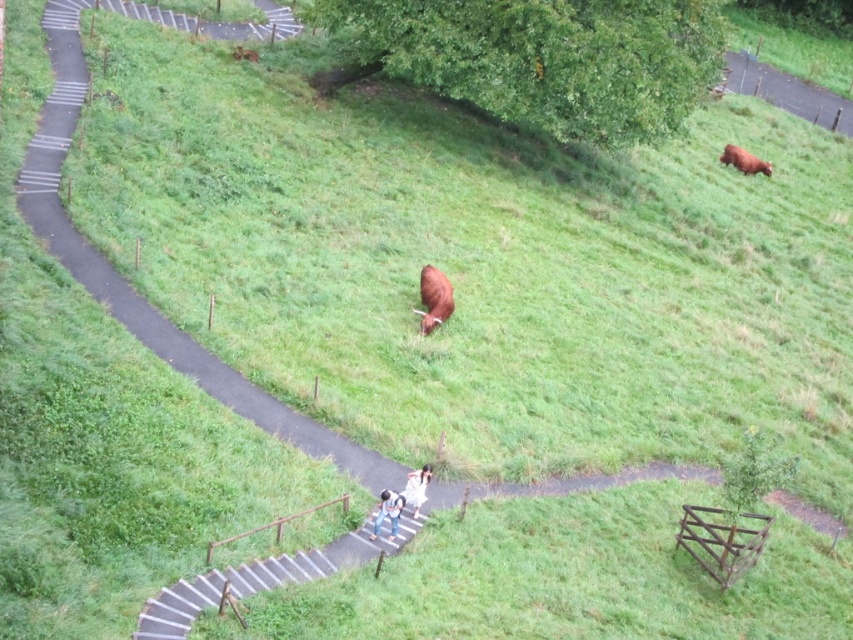
Can you confirm if metallic gray stairs at lower center is shorter than blue denim jeans at center?

Yes, metallic gray stairs at lower center is shorter than blue denim jeans at center.

Between metallic gray stairs at lower center and blue denim jeans at center, which one has more height?

blue denim jeans at center is taller.

The width and height of the screenshot is (853, 640). Identify the location of metallic gray stairs at lower center. (260, 579).

Identify the location of metallic gray stairs at lower center. The image size is (853, 640). (260, 579).

Is blue denim jeans at center smaller than brown matte cow at upper right?

Correct, blue denim jeans at center occupies less space than brown matte cow at upper right.

Between point (376, 516) and point (744, 172), which one is positioned behind?

The point (744, 172) is more distant.

What do you see at coordinates (387, 513) in the screenshot? I see `blue denim jeans at center` at bounding box center [387, 513].

Find the location of `blue denim jeans at center`. blue denim jeans at center is located at coordinates (387, 513).

Is brown furry cow at center below white fabric at center?

Actually, brown furry cow at center is above white fabric at center.

Is brown furry cow at center above white fabric at center?

Yes, brown furry cow at center is above white fabric at center.

Who is more forward, (445, 305) or (410, 476)?

Positioned in front is point (410, 476).

This screenshot has height=640, width=853. Identify the location of brown furry cow at center. (433, 298).